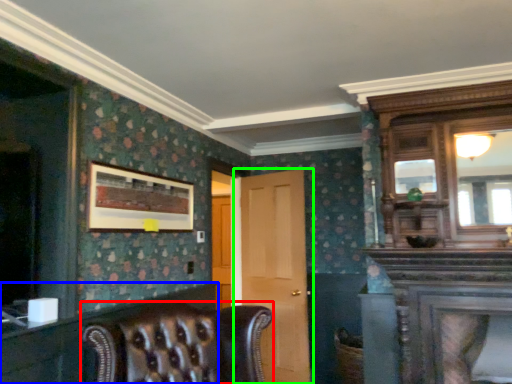
Question: Based on their relative distances, which object is farther from chair (highlighted by a red box)? Choose from dresser (highlighted by a blue box) and door (highlighted by a green box).

Choices:
 (A) dresser
 (B) door

Answer: (B)